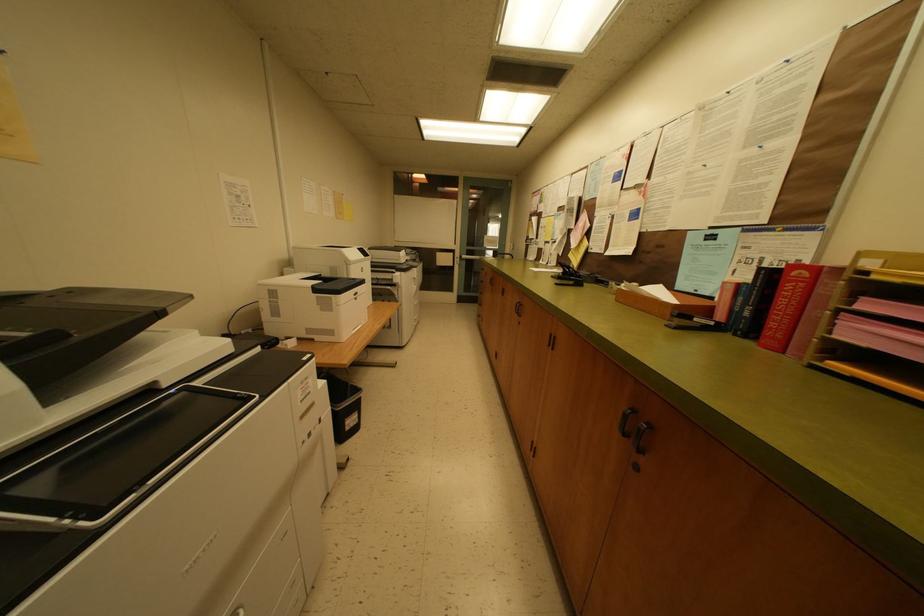
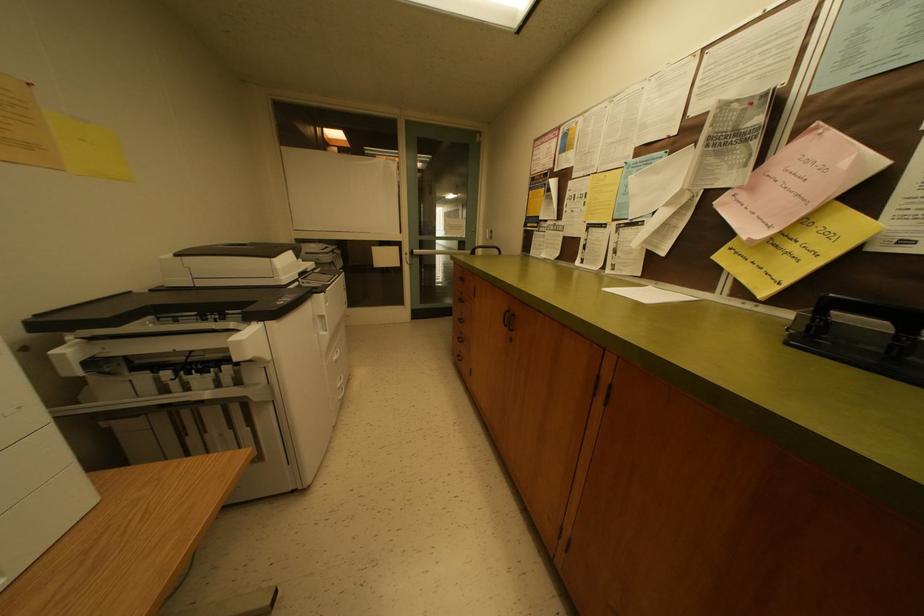
Question: Which direction would the cameraman need to move to produce the second image? Reply with the corresponding letter.

Choices:
 (A) Left
 (B) Right
 (C) Forward
 (D) Backward

Answer: (C)